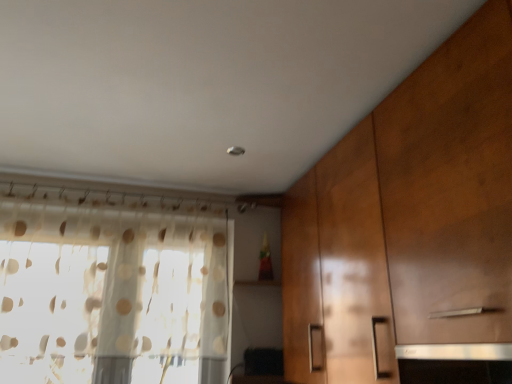
Question: Does translucent fabric curtain at left appear on the left side of wooden cabinet at right?

Choices:
 (A) no
 (B) yes

Answer: (B)

Question: From the image's perspective, is translucent fabric curtain at left beneath wooden cabinet at right?

Choices:
 (A) no
 (B) yes

Answer: (B)

Question: Is translucent fabric curtain at left positioned before wooden cabinet at right?

Choices:
 (A) yes
 (B) no

Answer: (B)

Question: Is wooden cabinet at right surrounded by translucent fabric curtain at left?

Choices:
 (A) yes
 (B) no

Answer: (B)

Question: Does translucent fabric curtain at left have a lesser width compared to wooden cabinet at right?

Choices:
 (A) no
 (B) yes

Answer: (B)

Question: Is translucent fabric curtain at left turned away from wooden cabinet at right?

Choices:
 (A) yes
 (B) no

Answer: (B)

Question: Does wooden cabinet at right have a greater width compared to translucent fabric curtain at left?

Choices:
 (A) no
 (B) yes

Answer: (B)

Question: Considering the relative sizes of wooden cabinet at right and translucent fabric curtain at left in the image provided, is wooden cabinet at right thinner than translucent fabric curtain at left?

Choices:
 (A) no
 (B) yes

Answer: (A)

Question: Is wooden cabinet at right shorter than translucent fabric curtain at left?

Choices:
 (A) yes
 (B) no

Answer: (B)

Question: Is wooden cabinet at right further to camera compared to translucent fabric curtain at left?

Choices:
 (A) no
 (B) yes

Answer: (A)

Question: Can you confirm if wooden cabinet at right is taller than translucent fabric curtain at left?

Choices:
 (A) yes
 (B) no

Answer: (A)

Question: Does wooden cabinet at right come in front of translucent fabric curtain at left?

Choices:
 (A) yes
 (B) no

Answer: (A)

Question: From the image's perspective, is translucent fabric curtain at left located above or below wooden cabinet at right?

Choices:
 (A) below
 (B) above

Answer: (A)